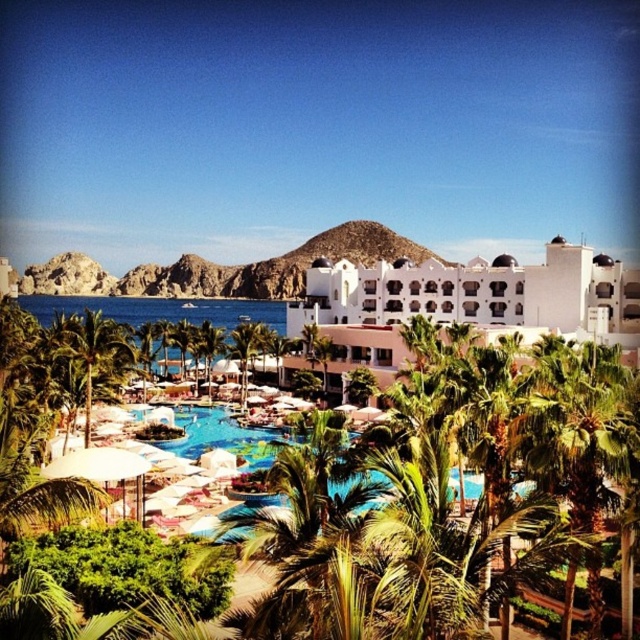
Question: Can you confirm if green leafy palm tree at lower left is positioned to the left of green leafy palm tree at center?

Choices:
 (A) no
 (B) yes

Answer: (B)

Question: Which point is closer to the camera?

Choices:
 (A) (240, 381)
 (B) (93, 348)
 (C) (412, 269)

Answer: (B)

Question: Does white matte building at center appear on the left side of green leafy palm tree at center?

Choices:
 (A) yes
 (B) no

Answer: (B)

Question: Which point appears farthest from the camera in this image?

Choices:
 (A) (248, 348)
 (B) (84, 394)
 (C) (541, 324)

Answer: (A)

Question: Which of the following is the farthest from the observer?

Choices:
 (A) green leafy palm tree at lower left
 (B) white matte building at center
 (C) green leafy palm tree at center

Answer: (C)

Question: Can you confirm if green leafy palm tree at lower left is positioned to the left of green leafy palm tree at center?

Choices:
 (A) no
 (B) yes

Answer: (B)